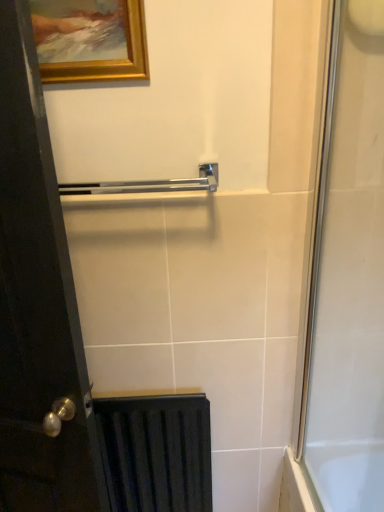
Question: Is matte black radiator at lower left behind gold wooden picture frame at upper left?

Choices:
 (A) no
 (B) yes

Answer: (B)

Question: Can you confirm if matte black radiator at lower left is thinner than gold wooden picture frame at upper left?

Choices:
 (A) no
 (B) yes

Answer: (A)

Question: Is matte black radiator at lower left bigger than gold wooden picture frame at upper left?

Choices:
 (A) no
 (B) yes

Answer: (B)

Question: From a real-world perspective, is matte black radiator at lower left beneath gold wooden picture frame at upper left?

Choices:
 (A) no
 (B) yes

Answer: (B)

Question: Is matte black radiator at lower left taller than gold wooden picture frame at upper left?

Choices:
 (A) no
 (B) yes

Answer: (B)

Question: Is matte black radiator at lower left to the right of gold wooden picture frame at upper left from the viewer's perspective?

Choices:
 (A) no
 (B) yes

Answer: (B)

Question: Is matte black radiator at lower left inside clear glass shower door at right?

Choices:
 (A) yes
 (B) no

Answer: (B)

Question: From a real-world perspective, is clear glass shower door at right over matte black radiator at lower left?

Choices:
 (A) yes
 (B) no

Answer: (A)

Question: Is clear glass shower door at right to the left of matte black radiator at lower left from the viewer's perspective?

Choices:
 (A) no
 (B) yes

Answer: (A)

Question: Is clear glass shower door at right far from matte black radiator at lower left?

Choices:
 (A) yes
 (B) no

Answer: (B)

Question: Is clear glass shower door at right outside matte black radiator at lower left?

Choices:
 (A) yes
 (B) no

Answer: (A)

Question: Is clear glass shower door at right placed right next to matte black radiator at lower left?

Choices:
 (A) yes
 (B) no

Answer: (B)

Question: From a real-world perspective, is clear glass shower door at right beneath black wood door at left?

Choices:
 (A) no
 (B) yes

Answer: (A)